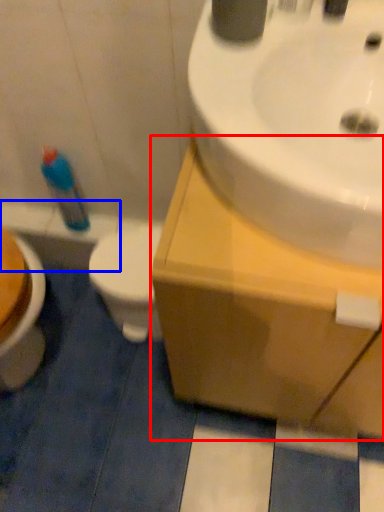
Question: Which point is closer to the camera, counter top (highlighted by a red box) or bath (highlighted by a blue box)?

Choices:
 (A) counter top
 (B) bath

Answer: (A)